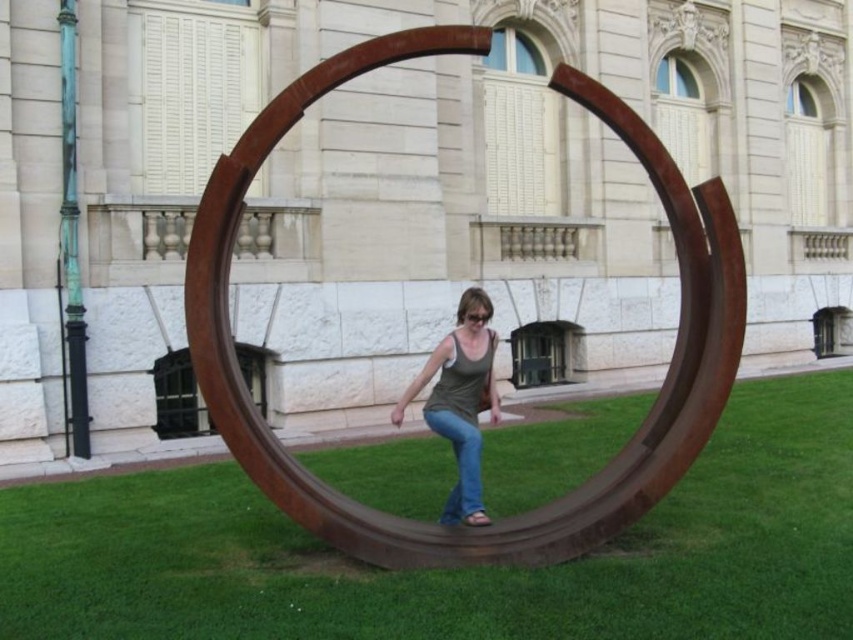
Question: Which point is farther from the camera taking this photo?

Choices:
 (A) (142, 488)
 (B) (573, 529)

Answer: (A)

Question: Among these objects, which one is farthest from the camera?

Choices:
 (A) matte gray tank top at center
 (B) rusty metal circle at center
 (C) jeans at center

Answer: (A)

Question: Is green grass at center to the left of matte gray tank top at center from the viewer's perspective?

Choices:
 (A) no
 (B) yes

Answer: (A)

Question: Does green grass at center have a smaller size compared to matte gray tank top at center?

Choices:
 (A) yes
 (B) no

Answer: (B)

Question: Does green grass at center have a greater width compared to rusty metal circle at center?

Choices:
 (A) no
 (B) yes

Answer: (B)

Question: Which point is closer to the camera?

Choices:
 (A) matte gray tank top at center
 (B) jeans at center
 (C) green grass at center

Answer: (C)